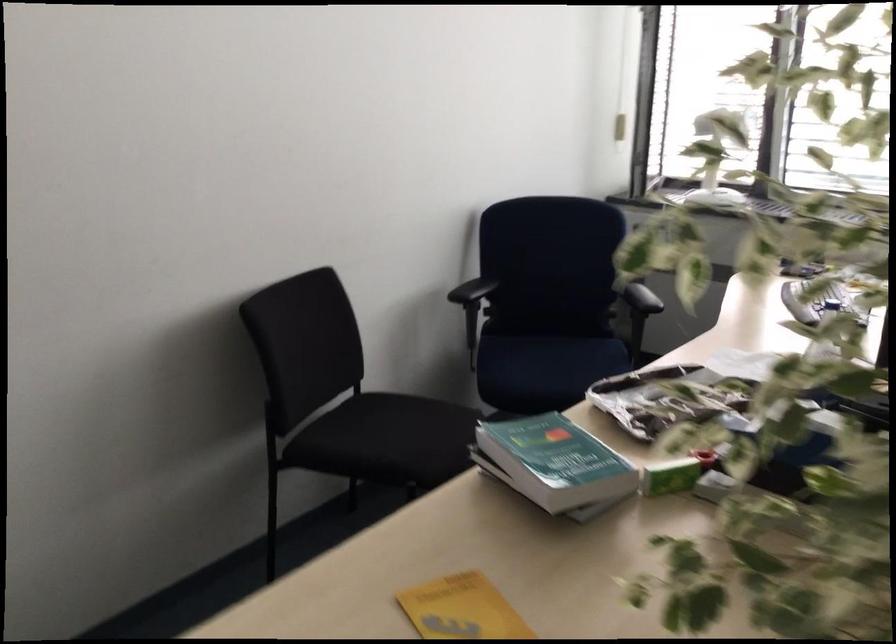
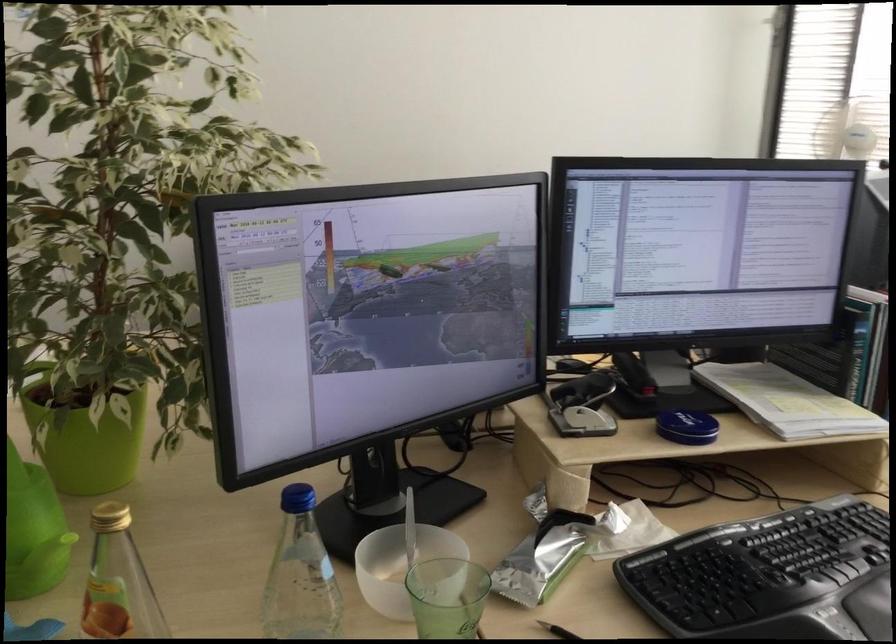
Question: I am providing you with two images of the same scene from different viewpoints. Please identify which objects are invisible in image2.

Choices:
 (A) hole punch lever
 (B) black pen
 (C) small green box
 (D) blue ironing board

Answer: (C)